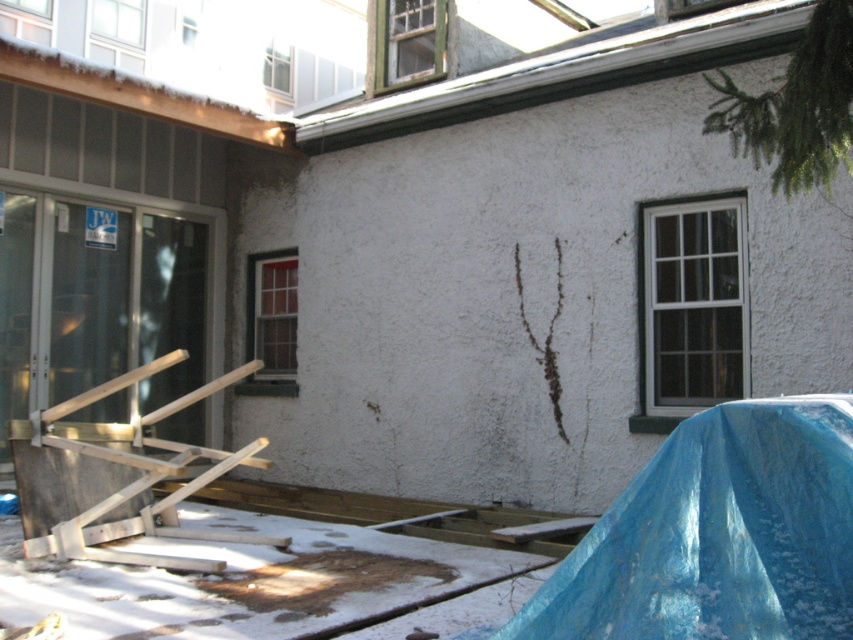
You are standing at the base of the residential building looking up. There are two points marked on the wall. One is at point coordinates point (790, 602) and the other at point (184, 284). Which point is closer to you?

Point (790, 602) is in front of point (184, 284), so the point at coordinates point (790, 602) is closer to you.

You are a delivery person trying to access the entrance of the residential building. You see the blue plastic tarp at lower right and the clear glass screen door at left. Which object is closer to you as you approach the building?

The blue plastic tarp at lower right is closer to the viewer than the clear glass screen door at left, so the blue plastic tarp at lower right would be closer to you as you approach the building.